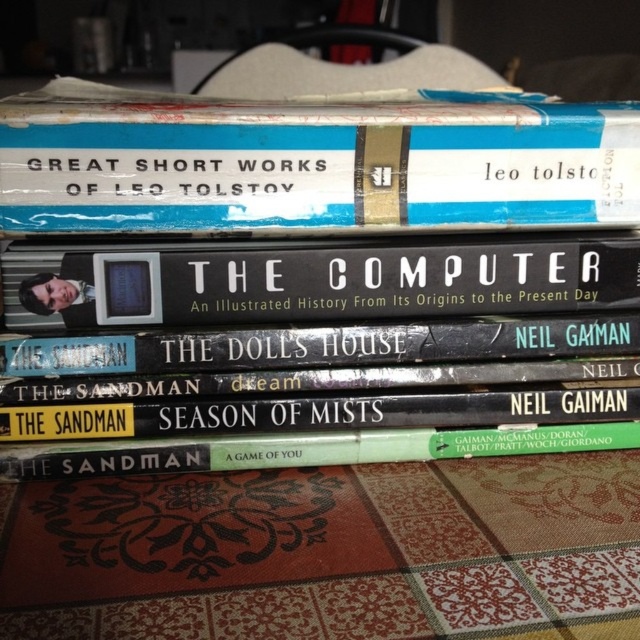
Can you confirm if hardcover book at center is taller than black hardcover book at center?

Indeed, hardcover book at center has a greater height compared to black hardcover book at center.

Can you confirm if hardcover book at center is bigger than black hardcover book at center?

Indeed, hardcover book at center has a larger size compared to black hardcover book at center.

Between point (636, 392) and point (604, 237), which one is positioned behind?

Positioned behind is point (636, 392).

Find the location of a particular element. The width and height of the screenshot is (640, 640). hardcover book at center is located at coordinates (323, 296).

Is blue hardcover book at upper center further to the viewer compared to green matte book at center?

No, it is not.

Does point (54, 93) come in front of point (176, 444)?

No, it is behind (176, 444).

Identify the location of blue hardcover book at upper center. The width and height of the screenshot is (640, 640). (308, 163).

Is blue hardcover book at upper center thinner than black hardcover book at center?

No.

Is blue hardcover book at upper center bigger than black hardcover book at center?

Yes, blue hardcover book at upper center is bigger than black hardcover book at center.

In order to click on blue hardcover book at upper center in this screenshot , I will do `click(308, 163)`.